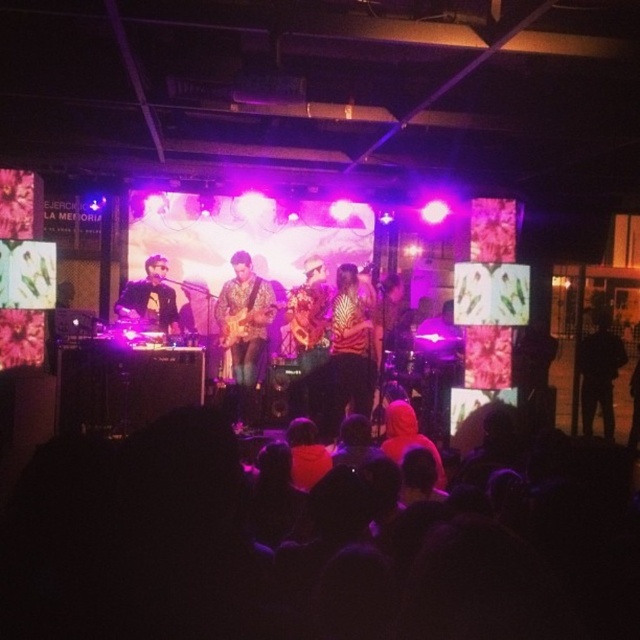
Can you confirm if black fabric at lower center is taller than zebra-patterned shirt at center?

No, black fabric at lower center is not taller than zebra-patterned shirt at center.

Is point (312, 518) behind point (339, 292)?

That is False.

Is point (179, 518) closer to viewer compared to point (369, 362)?

That is True.

At what (x,y) coordinates should I click in order to perform the action: click on black fabric at lower center. Please return your answer as a coordinate pair (x, y). Looking at the image, I should click on (298, 552).

Can you confirm if floral fabric guitar at center is positioned above matte black keyboard at left?

Incorrect, floral fabric guitar at center is not positioned above matte black keyboard at left.

Which is more to the right, floral fabric guitar at center or matte black keyboard at left?

floral fabric guitar at center

Between point (257, 276) and point (141, 296), which one is positioned in front?

Point (257, 276)

Find the location of a particular element. The height and width of the screenshot is (640, 640). floral fabric guitar at center is located at coordinates (244, 317).

Is black fabric at lower center above floral fabric guitar at center?

No.

Does black fabric at lower center have a lesser height compared to floral fabric guitar at center?

Yes, black fabric at lower center is shorter than floral fabric guitar at center.

Who is more distant from viewer, (x=428, y=504) or (x=237, y=333)?

Point (x=237, y=333)

I want to click on black fabric at lower center, so pyautogui.click(x=298, y=552).